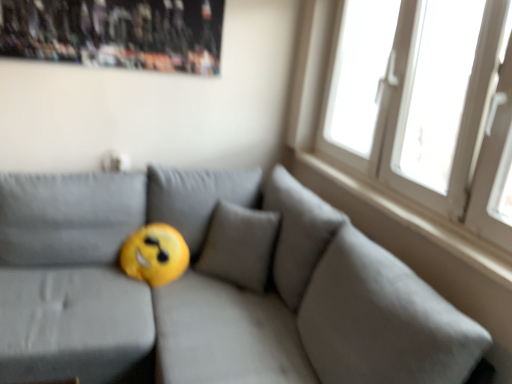
The image size is (512, 384). Describe the element at coordinates (415, 221) in the screenshot. I see `white smooth window sill at upper right` at that location.

Image resolution: width=512 pixels, height=384 pixels. I want to click on white smooth window sill at upper right, so click(415, 221).

Measure the distance between white plastic window at upper right and camera.

The depth of white plastic window at upper right is 4.21 feet.

Measure the distance between point [70,31] and camera.

2.07 meters.

What is the approximate width of yellow fabric pillow at center?

It is 1.81 meters.

The height and width of the screenshot is (384, 512). Identify the location of white smooth window sill at upper right. (415, 221).

Considering the relative sizes of white smooth window sill at upper right and wooden poster at upper left in the image provided, is white smooth window sill at upper right wider than wooden poster at upper left?

Yes.

The image size is (512, 384). I want to click on window sill that is below the wooden poster at upper left (from the image's perspective), so click(415, 221).

Considering the positions of point (500, 270) and point (165, 27), is point (500, 270) closer or farther from the camera than point (165, 27)?

Point (500, 270) appears to be closer to the viewer than point (165, 27).

From the image's perspective, would you say white smooth window sill at upper right is shown under wooden poster at upper left?

Yes, from the image's perspective, white smooth window sill at upper right is beneath wooden poster at upper left.

Considering the positions of point (312, 224) and point (57, 21), is point (312, 224) closer or farther from the camera than point (57, 21)?

Clearly, point (312, 224) is closer to the camera than point (57, 21).

Is yellow fabric pillow at center turned away from wooden poster at upper left?

No, yellow fabric pillow at center is not facing the opposite direction of wooden poster at upper left.

Which object is closer to the camera taking this photo, yellow fabric pillow at center or wooden poster at upper left?

yellow fabric pillow at center.

How different are the orientations of yellow fabric pillow at center and wooden poster at upper left in degrees?

The angle between the facing direction of yellow fabric pillow at center and the facing direction of wooden poster at upper left is 1.15 degrees.

Would you say white smooth window sill at upper right is part of white plastic window at upper right's contents?

Yes, white smooth window sill at upper right is a part of white plastic window at upper right.

Where is `window above the white smooth window sill at upper right (from the image's perspective)`? This screenshot has height=384, width=512. window above the white smooth window sill at upper right (from the image's perspective) is located at coordinates (456, 124).

Does white plastic window at upper right have a greater height compared to white smooth window sill at upper right?

Indeed, white plastic window at upper right has a greater height compared to white smooth window sill at upper right.

From a real-world perspective, between white plastic window at upper right and white smooth window sill at upper right, who is vertically higher?

white plastic window at upper right is physically above.

Is yellow fabric pillow at center behind white plastic window at upper right?

No, yellow fabric pillow at center is closer to the camera.

Can you see yellow fabric pillow at center touching white plastic window at upper right?

No, yellow fabric pillow at center is not next to white plastic window at upper right.

Does white plastic window at upper right have a lesser width compared to yellow fabric pillow at center?

Yes.

From a real-world perspective, is white plastic window at upper right positioned under yellow fabric pillow at center based on gravity?

Incorrect, from a real-world perspective, white plastic window at upper right is higher than yellow fabric pillow at center.

Between point (314, 41) and point (21, 186), which one is positioned in front?

Positioned in front is point (21, 186).

Is yellow fabric pillow at center surrounded by white plastic window at upper right?

That's incorrect, yellow fabric pillow at center is not inside white plastic window at upper right.

From the image's perspective, which is below, wooden poster at upper left or white smooth window sill at upper right?

From the image's view, white smooth window sill at upper right is below.

Considering the positions of objects wooden poster at upper left and white smooth window sill at upper right in the image provided, who is in front, wooden poster at upper left or white smooth window sill at upper right?

white smooth window sill at upper right is more forward.

What's the angular difference between wooden poster at upper left and white smooth window sill at upper right's facing directions?

89.8 degrees.

From the picture: Is wooden poster at upper left far away from white smooth window sill at upper right?

wooden poster at upper left is positioned a significant distance from white smooth window sill at upper right.

Which object is positioned more to the right, wooden poster at upper left or white plastic window at upper right?

white plastic window at upper right is more to the right.

Can you tell me how much wooden poster at upper left and white plastic window at upper right differ in facing direction?

The angle between the facing direction of wooden poster at upper left and the facing direction of white plastic window at upper right is 90 degrees.

From the image's perspective, between wooden poster at upper left and white plastic window at upper right, who is located below?

white plastic window at upper right, from the image's perspective.

Looking at this image, is wooden poster at upper left surrounding white plastic window at upper right?

No, white plastic window at upper right is not inside wooden poster at upper left.

Image resolution: width=512 pixels, height=384 pixels. In order to click on window sill on the right of the wooden poster at upper left in this screenshot , I will do `click(415, 221)`.

This screenshot has height=384, width=512. Identify the location of bulletin board above the yellow fabric pillow at center (from a real-world perspective). (116, 33).

Based on their spatial positions, is white plastic window at upper right or wooden poster at upper left closer to yellow fabric pillow at center?

white plastic window at upper right is closer to yellow fabric pillow at center.

When comparing their distances from white smooth window sill at upper right, does yellow fabric pillow at center or white plastic window at upper right seem further?

Among the two, yellow fabric pillow at center is located further to white smooth window sill at upper right.

When comparing their distances from yellow fabric pillow at center, does white smooth window sill at upper right or white plastic window at upper right seem closer?

Based on the image, white smooth window sill at upper right appears to be nearer to yellow fabric pillow at center.

From the image, which object appears to be nearer to yellow fabric pillow at center, wooden poster at upper left or white smooth window sill at upper right?

white smooth window sill at upper right is closer to yellow fabric pillow at center.

Estimate the real-world distances between objects in this image. Which object is closer to white smooth window sill at upper right, white plastic window at upper right or wooden poster at upper left?

white plastic window at upper right is positioned closer to the anchor white smooth window sill at upper right.

Based on their spatial positions, is yellow fabric pillow at center or wooden poster at upper left further from white plastic window at upper right?

Among the two, wooden poster at upper left is located further to white plastic window at upper right.

Estimate the real-world distances between objects in this image. Which object is further from white plastic window at upper right, yellow fabric pillow at center or white smooth window sill at upper right?

Among the two, yellow fabric pillow at center is located further to white plastic window at upper right.

Looking at the image, which one is located closer to white plastic window at upper right, wooden poster at upper left or white smooth window sill at upper right?

white smooth window sill at upper right is positioned closer to the anchor white plastic window at upper right.

Image resolution: width=512 pixels, height=384 pixels. What are the coordinates of `window sill located between yellow fabric pillow at center and wooden poster at upper left in the depth direction` in the screenshot? It's located at (415, 221).

You are a GUI agent. You are given a task and a screenshot of the screen. Output one action in this format:
    pyautogui.click(x=<x>, y=<y>)
    Task: Click on the window sill between yellow fabric pillow at center and white plastic window at upper right in the horizontal direction
    
    Given the screenshot: What is the action you would take?
    pyautogui.click(x=415, y=221)

Identify the location of window between yellow fabric pillow at center and wooden poster at upper left from front to back. (456, 124).

Locate an element on the screen. Image resolution: width=512 pixels, height=384 pixels. window sill between wooden poster at upper left and white plastic window at upper right in the horizontal direction is located at coordinates (415, 221).